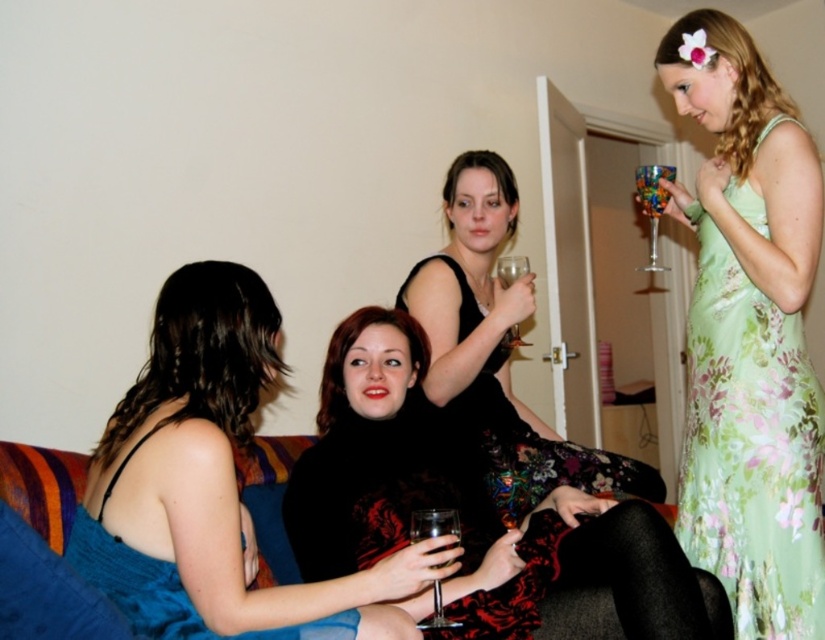
Question: Is blue satin dress at center to the right of velvet couch at lower center from the viewer's perspective?

Choices:
 (A) yes
 (B) no

Answer: (A)

Question: Can you confirm if blue satin dress at lower left is bigger than transparent glass at center?

Choices:
 (A) no
 (B) yes

Answer: (B)

Question: Which of these objects is positioned closest to the blue satin dress at lower left?

Choices:
 (A) velvet couch at lower center
 (B) translucent glass wine glass at upper right
 (C) transparent glass wine glass at lower center

Answer: (C)

Question: Which of the following is the farthest from the observer?

Choices:
 (A) (668, 180)
 (B) (279, 502)

Answer: (A)

Question: Which point is farther from the camera taking this photo?

Choices:
 (A) (295, 509)
 (B) (661, 170)
 (C) (331, 618)
 (D) (274, 525)

Answer: (B)

Question: Can you confirm if velvet couch at lower center is positioned to the left of transparent glass wine glass at lower center?

Choices:
 (A) no
 (B) yes

Answer: (B)